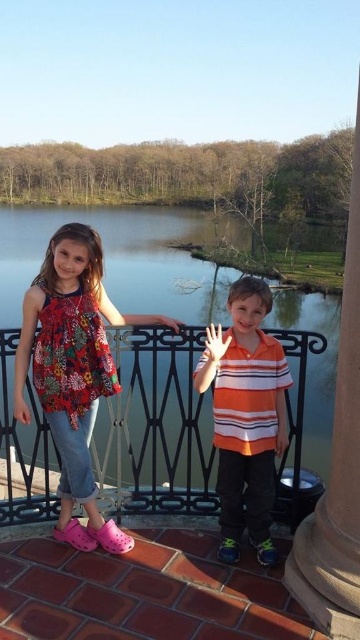
Is point (268, 420) more distant than point (351, 186)?

No.

Is orange striped shirt at center bigger than smooth stone pillar at right?

Incorrect, orange striped shirt at center is not larger than smooth stone pillar at right.

Locate an element on the screen. orange striped shirt at center is located at coordinates (246, 419).

Between smooth water at center and orange striped shirt at center, which one is positioned lower?

orange striped shirt at center

Is the position of smooth water at center less distant than that of orange striped shirt at center?

No.

Is point (187, 230) positioned after point (241, 442)?

Yes, point (187, 230) is behind point (241, 442).

Find the location of a particular element. Image resolution: width=360 pixels, height=640 pixels. smooth water at center is located at coordinates (123, 358).

Can you confirm if floral fabric blouse at upper left is taller than orange striped shirt at center?

Yes.

Does floral fabric blouse at upper left appear under orange striped shirt at center?

No.

The image size is (360, 640). In order to click on floral fabric blouse at upper left in this screenshot , I will do `click(72, 371)`.